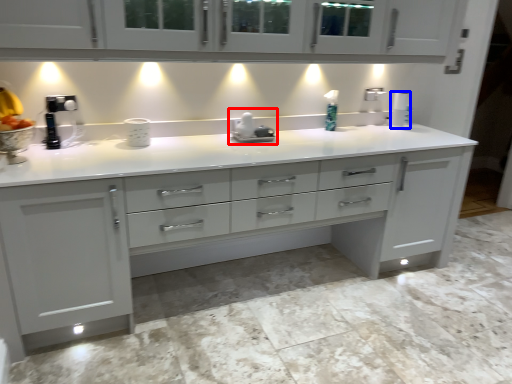
Question: Which of the following is the farthest to the observer, appliance (highlighted by a red box) or paper towel (highlighted by a blue box)?

Choices:
 (A) appliance
 (B) paper towel

Answer: (B)